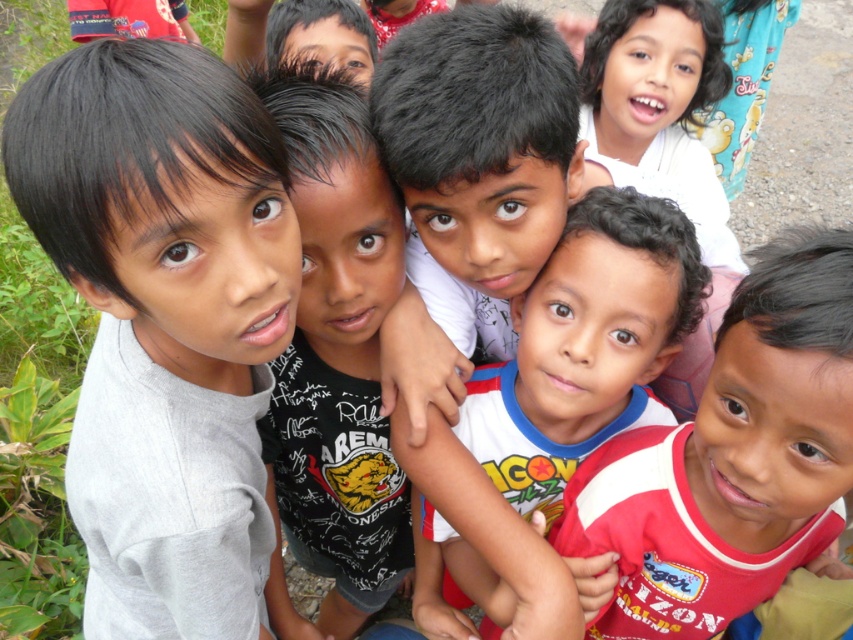
Question: Observing the image, what is the correct spatial positioning of gray matte shirt at left in reference to black printed t-shirt at center?

Choices:
 (A) above
 (B) below

Answer: (A)

Question: Which object is farther from the camera taking this photo?

Choices:
 (A) red cotton shirt at center
 (B) smooth skin boy at center
 (C) black printed t-shirt at center

Answer: (B)

Question: Which point appears closest to the camera in this image?

Choices:
 (A) (236, 298)
 (B) (819, 518)
 (C) (598, 200)
 (D) (314, 493)

Answer: (A)

Question: Can you confirm if gray matte shirt at left is positioned to the right of black printed t-shirt at center?

Choices:
 (A) no
 (B) yes

Answer: (A)

Question: Among these points, which one is farthest from the camera?

Choices:
 (A) (329, 572)
 (B) (186, 60)
 (C) (474, 588)

Answer: (A)

Question: Is red cotton shirt at center bigger than black printed t-shirt at center?

Choices:
 (A) no
 (B) yes

Answer: (A)